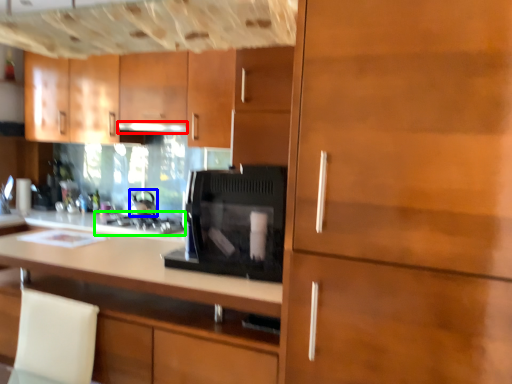
Question: Which object is positioned closest to exhaust hood (highlighted by a red box)? Select from appliance (highlighted by a blue box) and kitchen appliance (highlighted by a green box).

Choices:
 (A) appliance
 (B) kitchen appliance

Answer: (A)